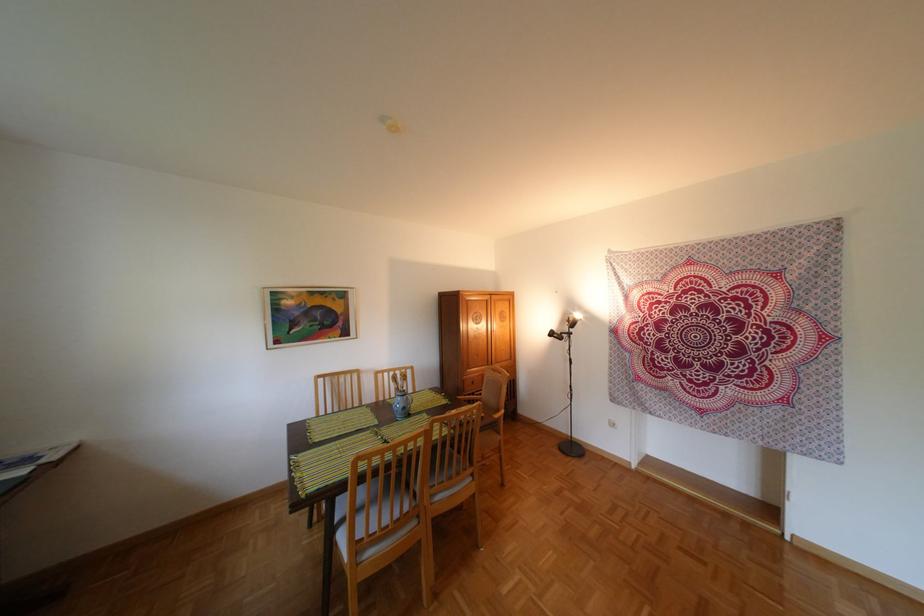
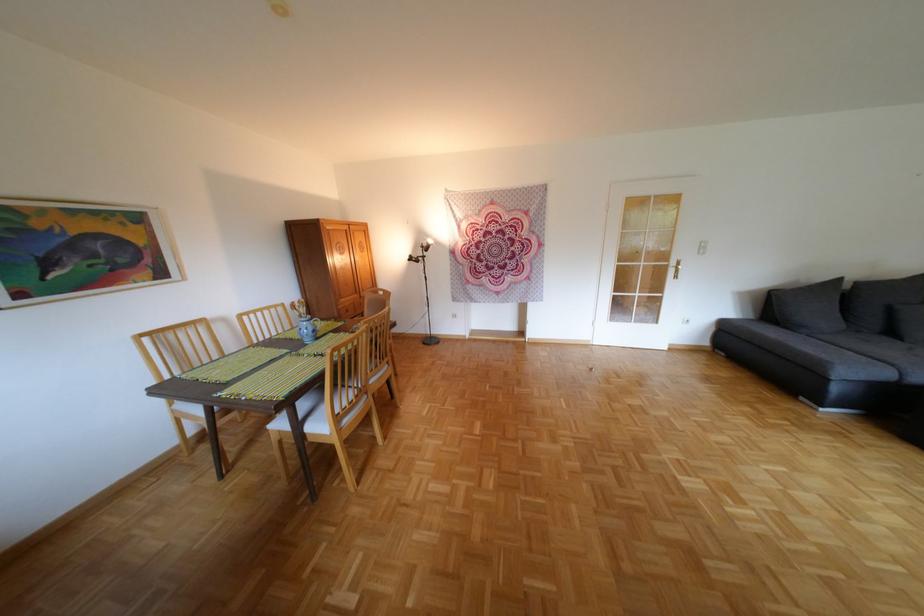
In the second image, find the point that corresponds to point 565,334 in the first image.

(423, 257)